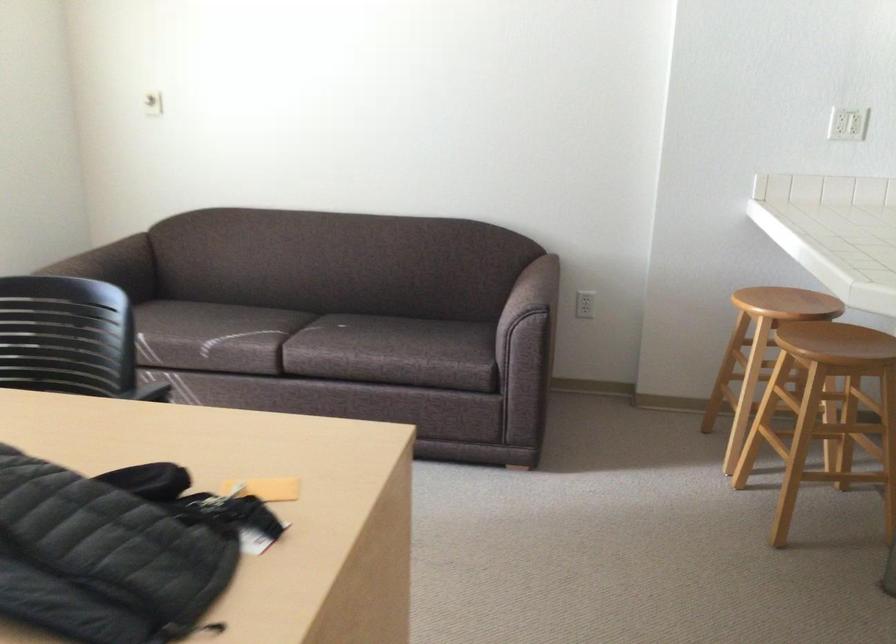
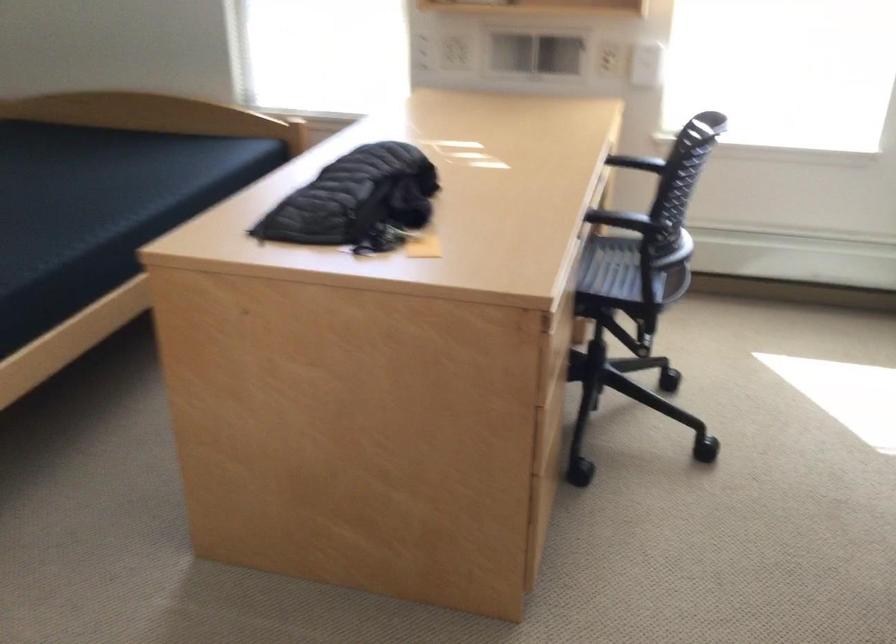
Find the pixel in the second image that matches the point at 261,480 in the first image.

(421, 245)